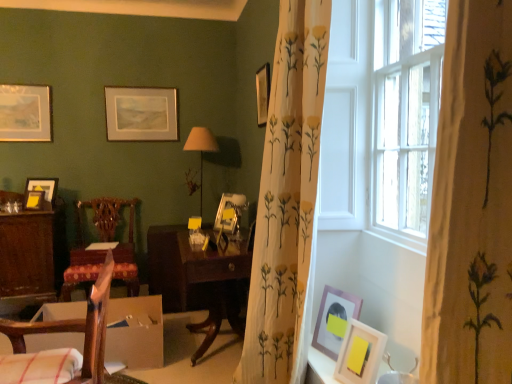
Question: From the image's perspective, is white floral-patterned curtain at center under wooden desk at left?

Choices:
 (A) yes
 (B) no

Answer: (B)

Question: Does white floral-patterned curtain at center touch wooden desk at left?

Choices:
 (A) yes
 (B) no

Answer: (B)

Question: Considering the relative sizes of white floral-patterned curtain at center and wooden desk at left in the image provided, is white floral-patterned curtain at center wider than wooden desk at left?

Choices:
 (A) yes
 (B) no

Answer: (B)

Question: Would you say white floral-patterned curtain at center is a long distance from wooden desk at left?

Choices:
 (A) no
 (B) yes

Answer: (B)

Question: From a real-world perspective, is white floral-patterned curtain at center physically below wooden desk at left?

Choices:
 (A) no
 (B) yes

Answer: (A)

Question: Would you say wooden picture frame at upper right, which ranks as the 6th picture frame in left-to-right order, is inside or outside matte gold picture frame at center, placed as the fourth picture frame when sorted from front to back?

Choices:
 (A) outside
 (B) inside

Answer: (A)

Question: Visually, is wooden picture frame at upper right, which appears as the 3th picture frame when viewed from the front, positioned to the left or to the right of matte gold picture frame at center, arranged as the 5th picture frame when viewed from the left?

Choices:
 (A) right
 (B) left

Answer: (A)

Question: Based on their sizes in the image, would you say wooden picture frame at upper right, the sixth picture frame from the back, is bigger or smaller than matte gold picture frame at center, arranged as the 5th picture frame when viewed from the left?

Choices:
 (A) big
 (B) small

Answer: (B)

Question: Relative to matte gold picture frame at center, the 5th picture frame from the back, is wooden picture frame at upper right, which appears as the 3th picture frame when viewed from the front, in front or behind?

Choices:
 (A) front
 (B) behind

Answer: (A)

Question: In the image, is cardboard box at lower left on the left side or the right side of matte gold picture frame at left, which is the third picture frame in left-to-right order?

Choices:
 (A) right
 (B) left

Answer: (A)

Question: Is cardboard box at lower left inside or outside of matte gold picture frame at left, the 6th picture frame in the right-to-left sequence?

Choices:
 (A) inside
 (B) outside

Answer: (B)

Question: Is point (56, 334) positioned closer to the camera than point (33, 201)?

Choices:
 (A) farther
 (B) closer

Answer: (B)

Question: Based on their sizes in the image, would you say cardboard box at lower left is bigger or smaller than matte gold picture frame at left, which is the third picture frame in left-to-right order?

Choices:
 (A) small
 (B) big

Answer: (B)

Question: Is matte gold picture frame at left, which is the third picture frame in left-to-right order, bigger or smaller than wooden chair at left, which is the second chair in left-to-right order?

Choices:
 (A) big
 (B) small

Answer: (B)

Question: From a real-world perspective, relative to wooden chair at left, positioned as the 1th chair in right-to-left order, is matte gold picture frame at left, the 5th picture frame when ordered from front to back, vertically above or below?

Choices:
 (A) below
 (B) above

Answer: (B)